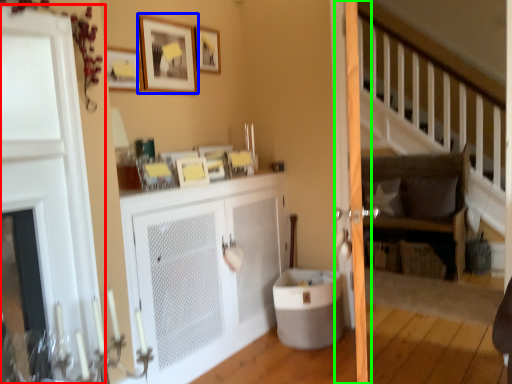
Question: Based on their relative distances, which object is nearer to door (highlighted by a red box)? Choose from picture frame (highlighted by a blue box) and screen door (highlighted by a green box).

Choices:
 (A) picture frame
 (B) screen door

Answer: (A)